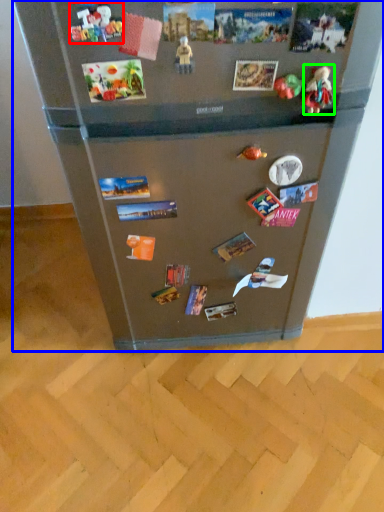
Question: Which object is positioned farthest from toy (highlighted by a red box)? Select from refrigerator (highlighted by a blue box) and toy (highlighted by a green box).

Choices:
 (A) refrigerator
 (B) toy

Answer: (A)